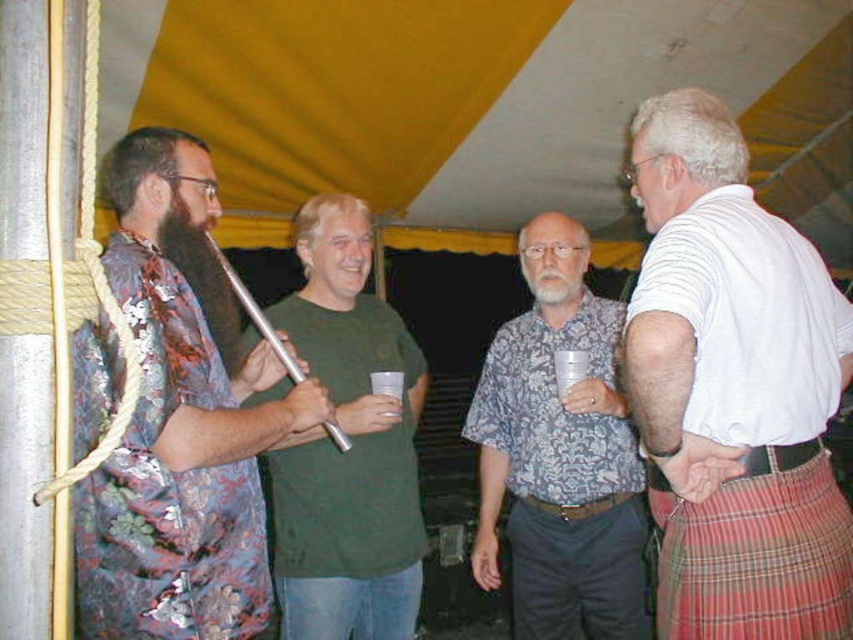
Who is positioned more to the right, green matte t-shirt at center or silver metallic flute at center?

green matte t-shirt at center is more to the right.

This screenshot has height=640, width=853. Find the location of `green matte t-shirt at center`. green matte t-shirt at center is located at coordinates (349, 449).

Image resolution: width=853 pixels, height=640 pixels. What do you see at coordinates (349, 449) in the screenshot?
I see `green matte t-shirt at center` at bounding box center [349, 449].

The width and height of the screenshot is (853, 640). I want to click on green matte t-shirt at center, so click(x=349, y=449).

You are a GUI agent. You are given a task and a screenshot of the screen. Output one action in this format:
    pyautogui.click(x=<x>, y=<y>)
    Task: Click on the white cotton shirt at right
    The image size is (853, 640).
    Given the screenshot: What is the action you would take?
    pyautogui.click(x=733, y=388)

Which is in front, point (651, 106) or point (312, 490)?

Point (651, 106) is in front.

Between point (726, 513) and point (363, 204), which one is positioned in front?

Point (726, 513) is in front.

Locate an element on the screen. Image resolution: width=853 pixels, height=640 pixels. white cotton shirt at right is located at coordinates (733, 388).

Is green matte t-shirt at center to the left of white plastic cup at center from the viewer's perspective?

Correct, you'll find green matte t-shirt at center to the left of white plastic cup at center.

You are a GUI agent. You are given a task and a screenshot of the screen. Output one action in this format:
    pyautogui.click(x=<x>, y=<y>)
    Task: Click on the green matte t-shirt at center
    Image resolution: width=853 pixels, height=640 pixels.
    Given the screenshot: What is the action you would take?
    pyautogui.click(x=349, y=449)